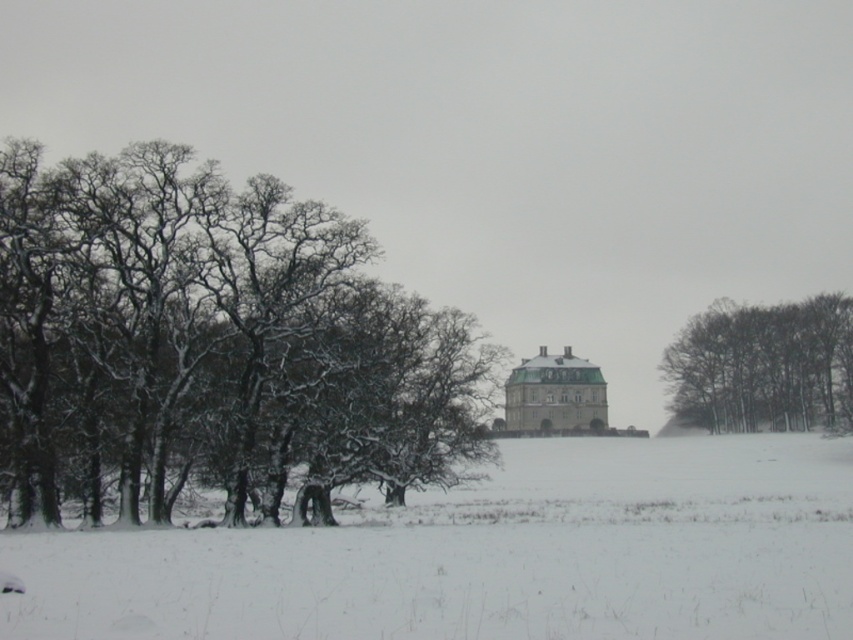
Does snow-covered bark trees at left lie in front of white fluffy snow at lower center?

No, it is behind white fluffy snow at lower center.

Is point (90, 390) positioned after point (605, 636)?

Yes, point (90, 390) is behind point (605, 636).

Image resolution: width=853 pixels, height=640 pixels. What are the coordinates of `snow-covered bark trees at left` in the screenshot? It's located at (212, 346).

Is white fluffy snow at lower center further to camera compared to dark brown textured tree at right?

No, it is not.

Measure the distance between white fluffy snow at lower center and camera.

They are 14.68 meters apart.

Image resolution: width=853 pixels, height=640 pixels. Identify the location of white fluffy snow at lower center. (491, 556).

Does snow-covered bark trees at left have a greater width compared to dark brown textured tree at right?

Indeed, snow-covered bark trees at left has a greater width compared to dark brown textured tree at right.

Which is more to the right, snow-covered bark trees at left or dark brown textured tree at right?

dark brown textured tree at right is more to the right.

In order to click on snow-covered bark trees at left in this screenshot , I will do (212, 346).

Identify the location of snow-covered bark trees at left. The height and width of the screenshot is (640, 853). (212, 346).